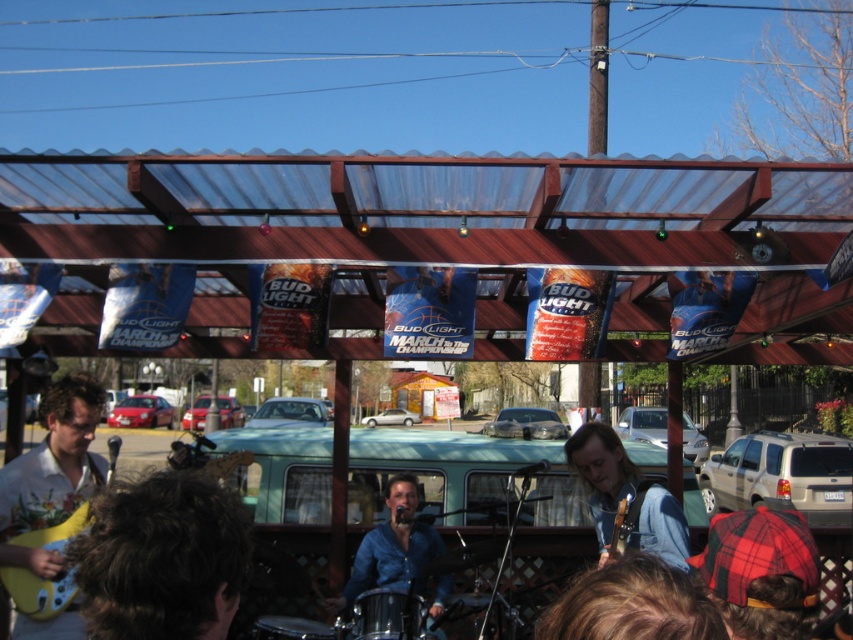
Question: Among these points, which one is farthest from the camera?

Choices:
 (A) (370, 580)
 (B) (47, 397)

Answer: (A)

Question: In this image, where is floral white shirt at lower left located relative to blue denim shirt at center?

Choices:
 (A) above
 (B) below

Answer: (A)

Question: Can you confirm if floral white shirt at lower left is positioned above blue denim shirt at center?

Choices:
 (A) yes
 (B) no

Answer: (A)

Question: Which of the following is the closest to the observer?

Choices:
 (A) (440, 576)
 (B) (28, 560)

Answer: (B)

Question: Does floral white shirt at lower left appear over blue denim shirt at center?

Choices:
 (A) yes
 (B) no

Answer: (A)